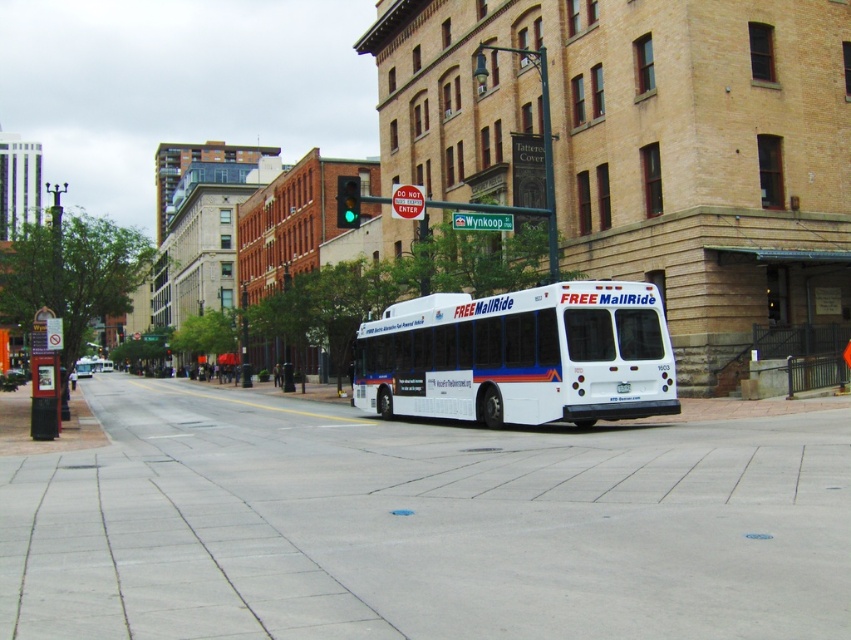
Consider the image. You are a delivery person who needs to park your van on the gray concrete pavement at center. However, there is a white matte bus at center currently occupying the space. Based on the scene description, can you park your van there without moving the bus?

The gray concrete pavement at center is positioned under the white matte bus at center, meaning the bus is parked directly on top of the pavement. Since the pavement is the same area where the bus is parked, you cannot park your van there without moving the bus.